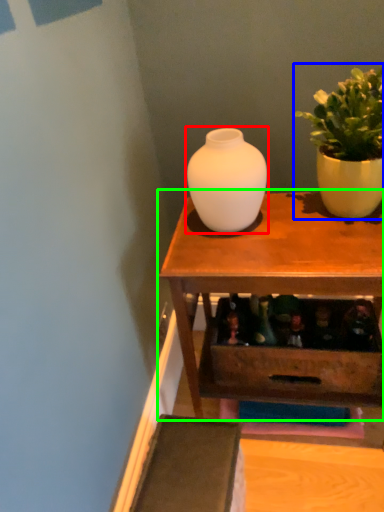
Question: Estimate the real-world distances between objects in this image. Which object is closer to vase (highlighted by a red box), houseplant (highlighted by a blue box) or table (highlighted by a green box)?

Choices:
 (A) houseplant
 (B) table

Answer: (B)